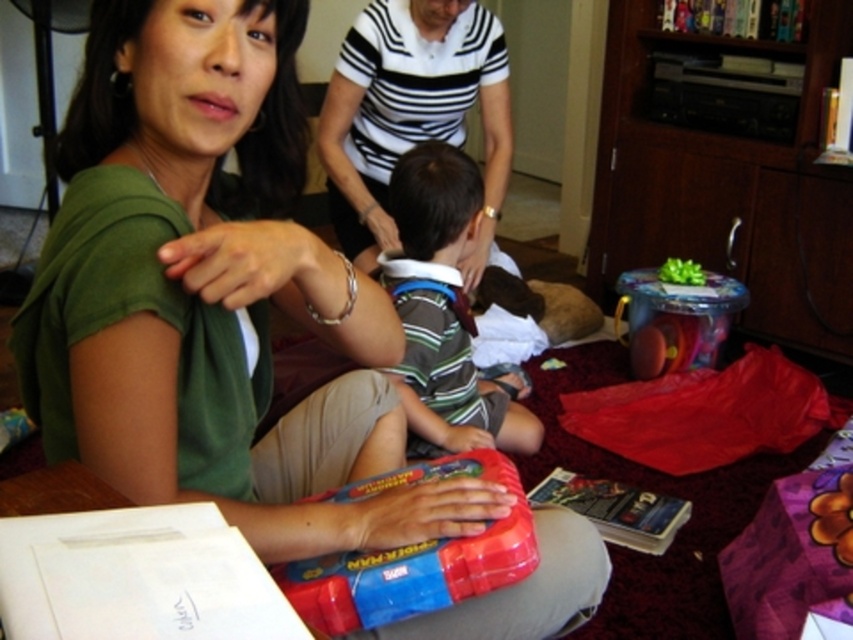
Question: Does green matte shirt at center appear on the left side of shiny metallic drum at center?

Choices:
 (A) yes
 (B) no

Answer: (A)

Question: Which is nearer to the shiny plastic toy at center?

Choices:
 (A) green matte shirt at center
 (B) striped fabric shirt at center

Answer: (A)

Question: Among these points, which one is nearest to the camera?

Choices:
 (A) (289, 180)
 (B) (631, 353)
 (C) (495, 420)
 (D) (300, 586)

Answer: (D)

Question: Is green matte shirt at center wider than striped fabric shirt at center?

Choices:
 (A) yes
 (B) no

Answer: (A)

Question: Does striped fabric shirt at center have a greater width compared to shiny plastic toy at center?

Choices:
 (A) no
 (B) yes

Answer: (B)

Question: Estimate the real-world distances between objects in this image. Which object is farther from the shiny plastic toy at center?

Choices:
 (A) striped fabric shirt at center
 (B) green matte shirt at center

Answer: (A)